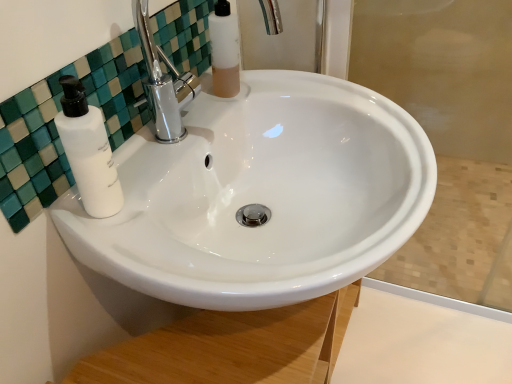
This screenshot has width=512, height=384. I want to click on free point behind white matte soap dispenser at left, so click(x=169, y=158).